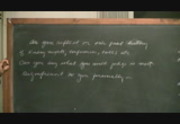
Locate an element on the screen. first line of writing on chalkboard is located at coordinates (35, 43), (49, 43), (68, 42), (86, 43), (100, 43), (116, 42), (135, 41).